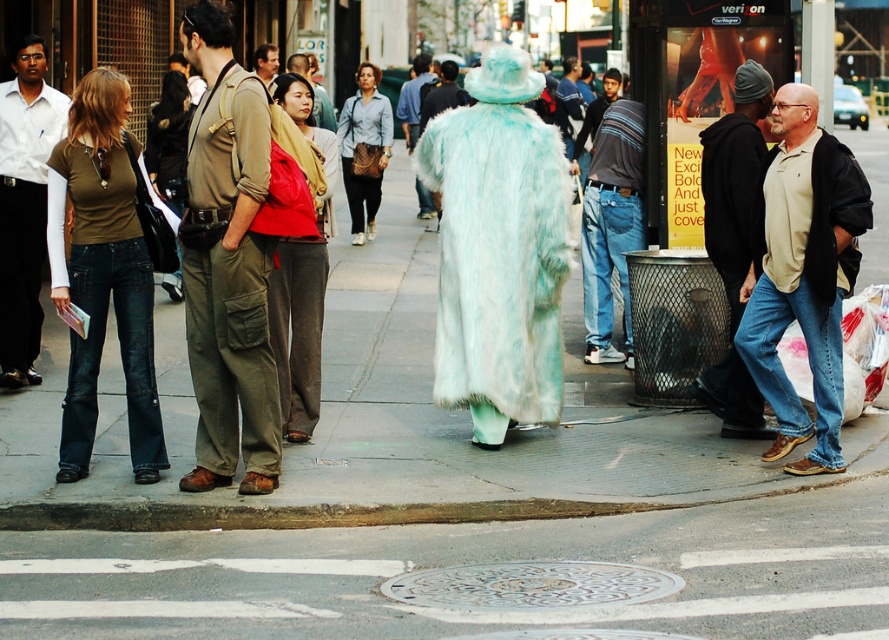
Between fuzzy light blue coat at center and matte brown jacket at center, which one is positioned lower?

Positioned lower is matte brown jacket at center.

Which is above, fuzzy light blue coat at center or matte brown jacket at center?

fuzzy light blue coat at center

What do you see at coordinates (413, 99) in the screenshot? Image resolution: width=889 pixels, height=640 pixels. I see `fuzzy light blue coat at center` at bounding box center [413, 99].

Find the location of `fuzzy light blue coat at center`. fuzzy light blue coat at center is located at coordinates (413, 99).

Who is more distant from viewer, (813, 189) or (625, 188)?

The point (625, 188) is more distant.

Can you confirm if beige cotton shirt at right is thinner than denim jeans at center?

Incorrect, beige cotton shirt at right's width is not less than denim jeans at center's.

What are the coordinates of `beige cotton shirt at right` in the screenshot? It's located at (802, 273).

Is matte green shirt at left further to the viewer compared to matte brown jacket at center?

No, matte green shirt at left is in front of matte brown jacket at center.

The image size is (889, 640). Describe the element at coordinates (103, 275) in the screenshot. I see `matte green shirt at left` at that location.

This screenshot has height=640, width=889. In order to click on matte green shirt at left in this screenshot , I will do `click(103, 275)`.